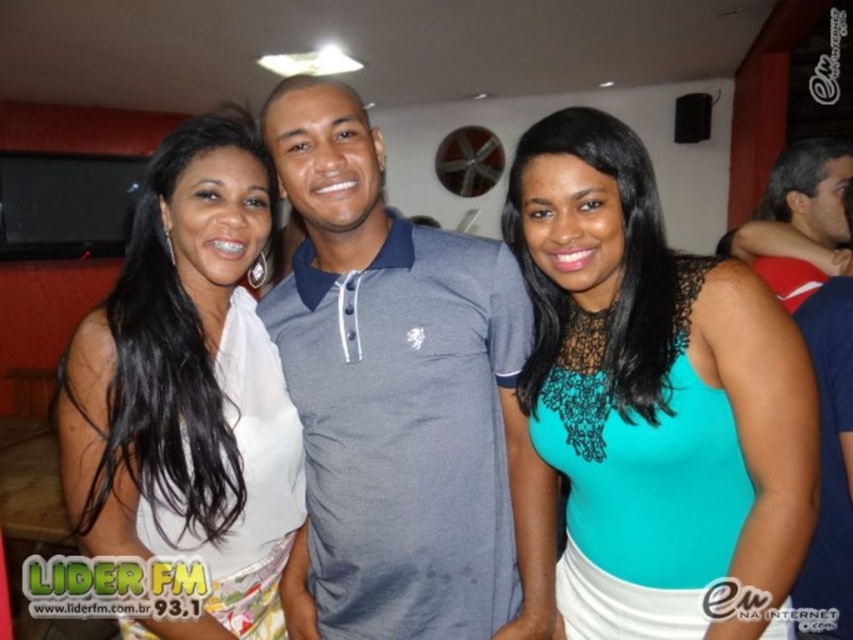
Does gray cotton polo shirt at center have a greater height compared to white satin blouse at center?

No, gray cotton polo shirt at center is not taller than white satin blouse at center.

Does point (326, 444) lie behind point (184, 344)?

That is True.

Identify the location of gray cotton polo shirt at center. Image resolution: width=853 pixels, height=640 pixels. (403, 397).

Consider the image. Is teal lace tank top at center below white satin blouse at center?

Yes.

Is teal lace tank top at center to the left of white satin blouse at center from the viewer's perspective?

Incorrect, teal lace tank top at center is not on the left side of white satin blouse at center.

You are a GUI agent. You are given a task and a screenshot of the screen. Output one action in this format:
    pyautogui.click(x=<x>, y=<y>)
    Task: Click on the teal lace tank top at center
    The image size is (853, 640).
    Given the screenshot: What is the action you would take?
    pyautogui.click(x=656, y=372)

You are a GUI agent. You are given a task and a screenshot of the screen. Output one action in this format:
    pyautogui.click(x=<x>, y=<y>)
    Task: Click on the teal lace tank top at center
    Image resolution: width=853 pixels, height=640 pixels.
    Given the screenshot: What is the action you would take?
    pyautogui.click(x=656, y=372)

Does gray cotton polo shirt at center appear on the right side of teal lace tank top at center?

In fact, gray cotton polo shirt at center is to the left of teal lace tank top at center.

At what (x,y) coordinates should I click in order to perform the action: click on gray cotton polo shirt at center. Please return your answer as a coordinate pair (x, y). Looking at the image, I should click on (403, 397).